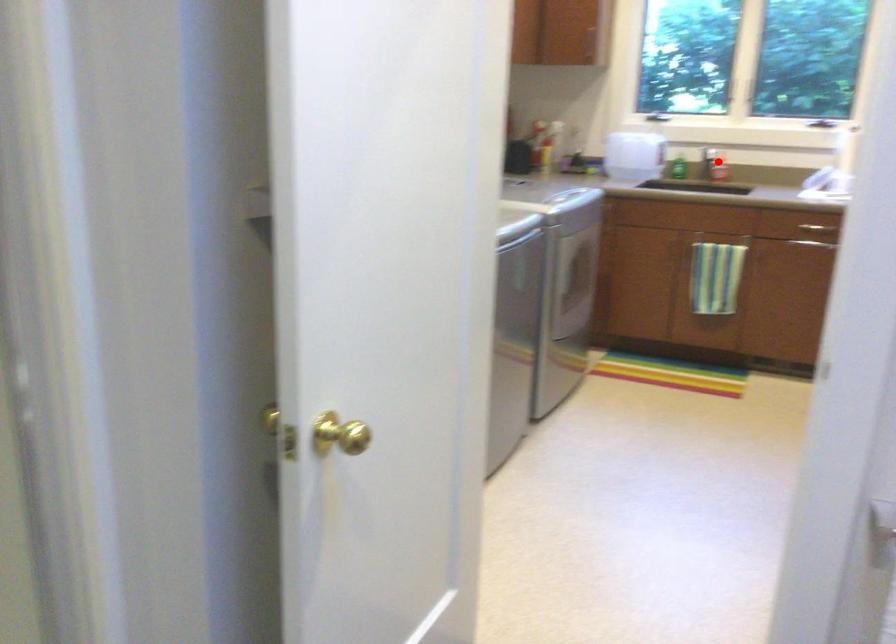
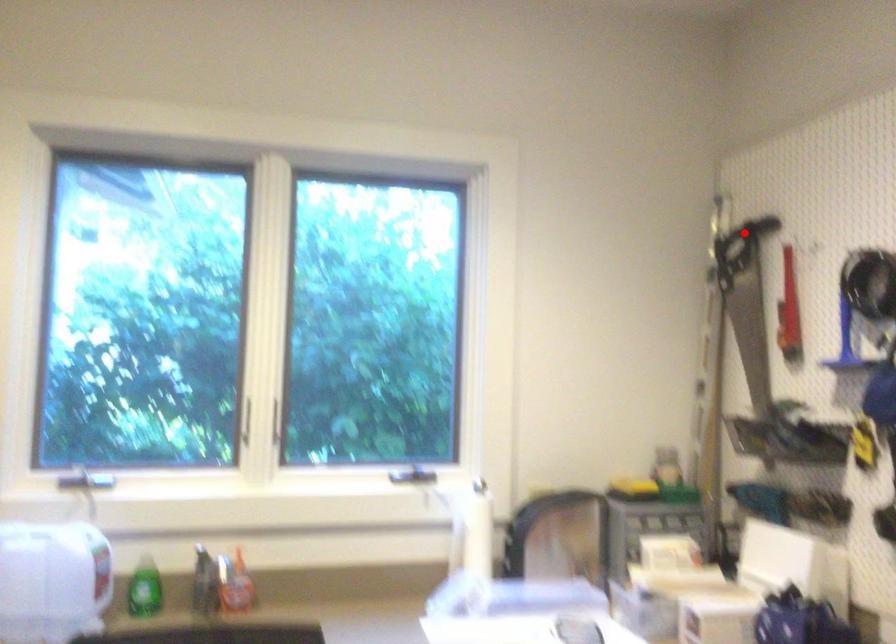
I am providing you with two images of the same scene from different viewpoints. A red point is marked on the first image and another point is marked on the second image. Is the marked point in image1 the same physical position as the marked point in image2?

No